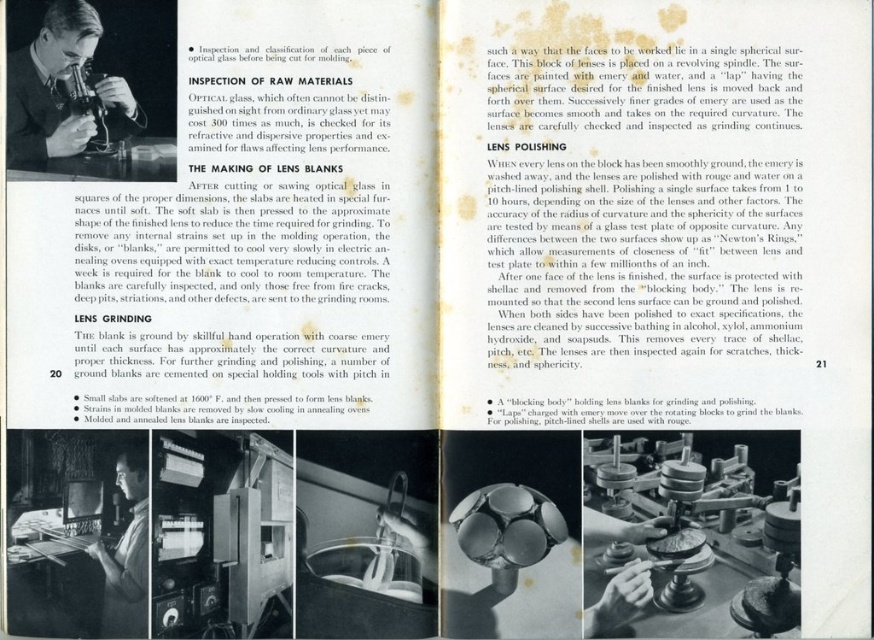
Consider the image. Is light brown wood microscope at upper left positioned behind smooth skin face at lower left?

Yes, it is.

Does light brown wood microscope at upper left have a lesser width compared to smooth skin face at lower left?

No, light brown wood microscope at upper left is not thinner than smooth skin face at lower left.

Is point (60, 109) closer to camera compared to point (129, 464)?

No, it is behind (129, 464).

Image resolution: width=874 pixels, height=640 pixels. In order to click on light brown wood microscope at upper left in this screenshot , I will do `click(50, 88)`.